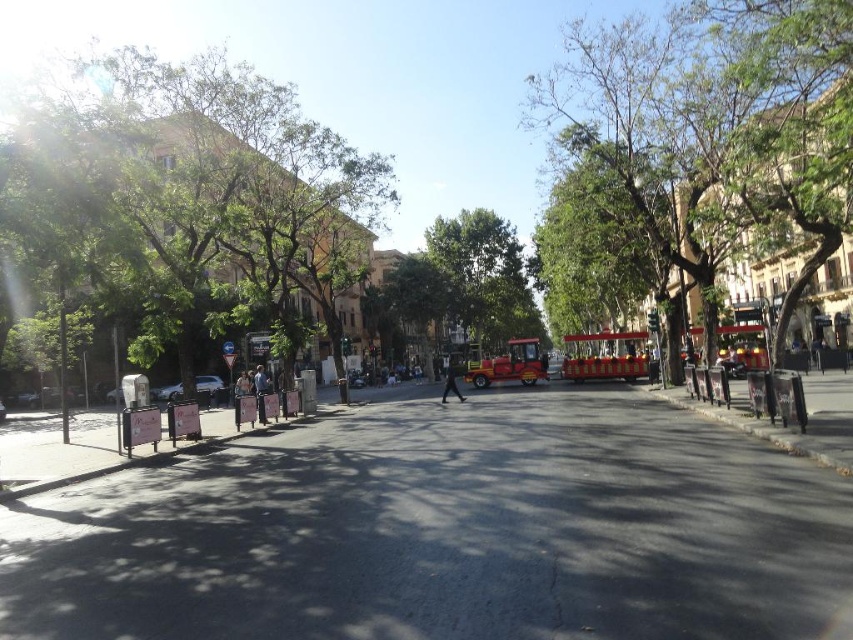
From the picture: Between red polished bus at center and light blue jeans at center, which one appears on the left side from the viewer's perspective?

From the viewer's perspective, light blue jeans at center appears more on the left side.

Which is behind, point (567, 376) or point (258, 385)?

The point (567, 376) is behind.

Find the location of a particular element. The image size is (853, 640). red polished bus at center is located at coordinates (605, 355).

Who is positioned more to the right, green leafy tree at center or metallic red trolley at center?

green leafy tree at center

Is the position of green leafy tree at center more distant than that of metallic red trolley at center?

That is False.

I want to click on green leafy tree at center, so click(x=717, y=125).

Between asphalt at center and red polished bus at center, which one is positioned lower?

asphalt at center

Between asphalt at center and red polished bus at center, which one appears on the right side from the viewer's perspective?

red polished bus at center is more to the right.

This screenshot has width=853, height=640. What are the coordinates of `asphalt at center` in the screenshot? It's located at (445, 531).

The width and height of the screenshot is (853, 640). I want to click on asphalt at center, so click(x=445, y=531).